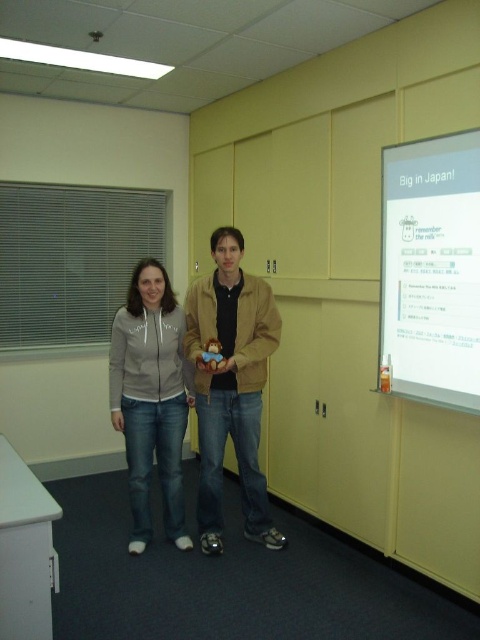
Question: Which object is the farthest from the white matte projection screen at upper right?

Choices:
 (A) matte gray hoodie at center
 (B) matte beige hoodie at center

Answer: (A)

Question: Is white matte projection screen at upper right above matte beige hoodie at center?

Choices:
 (A) no
 (B) yes

Answer: (B)

Question: Which point is farther to the camera?

Choices:
 (A) white matte projection screen at upper right
 (B) matte beige hoodie at center

Answer: (B)

Question: Is white matte projection screen at upper right closer to the viewer compared to matte beige hoodie at center?

Choices:
 (A) yes
 (B) no

Answer: (A)

Question: Does white matte projection screen at upper right appear under matte gray hoodie at center?

Choices:
 (A) yes
 (B) no

Answer: (B)

Question: Among these points, which one is farthest from the camera?

Choices:
 (A) (439, 284)
 (B) (247, 492)

Answer: (B)